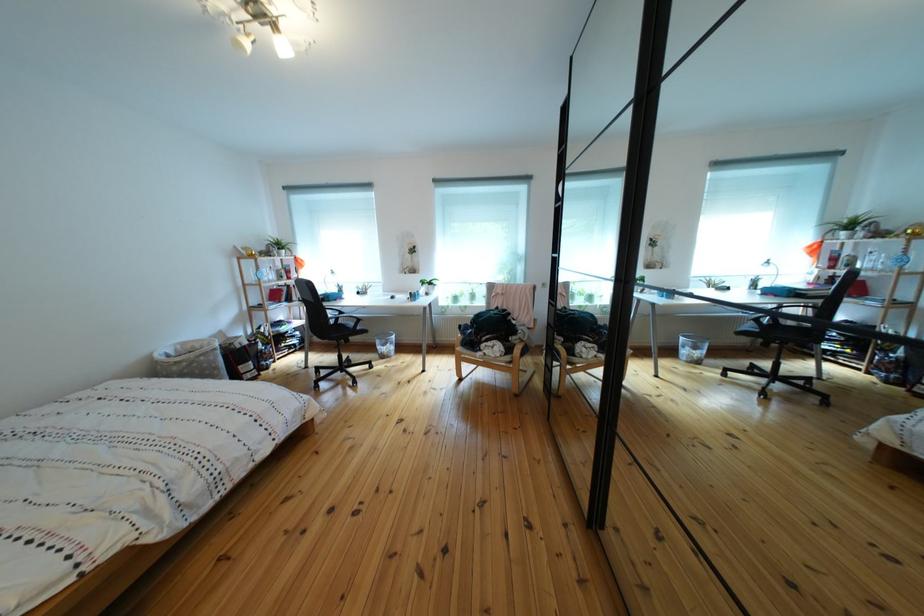
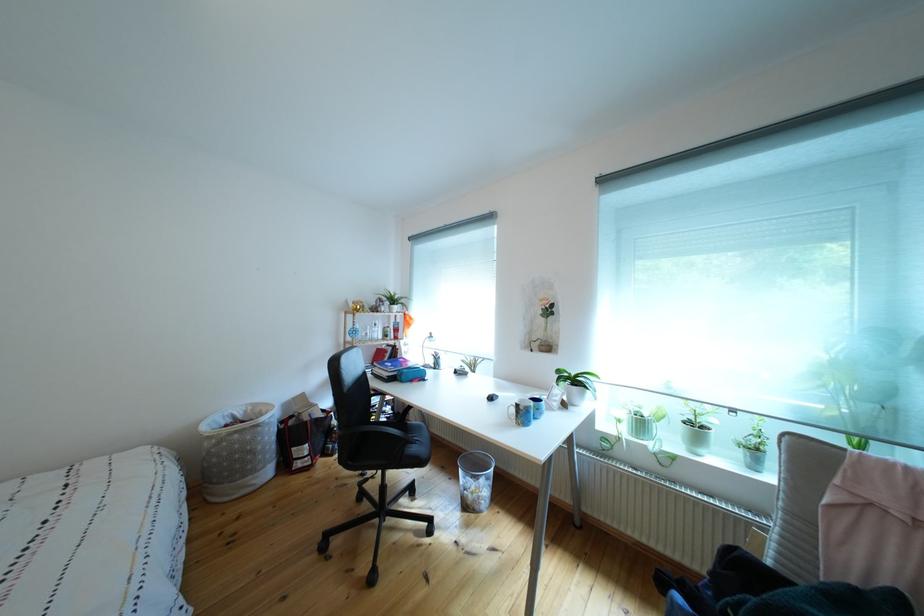
Where in the second image is the point corresponding to pixel 467 304 from the first image?

(652, 430)